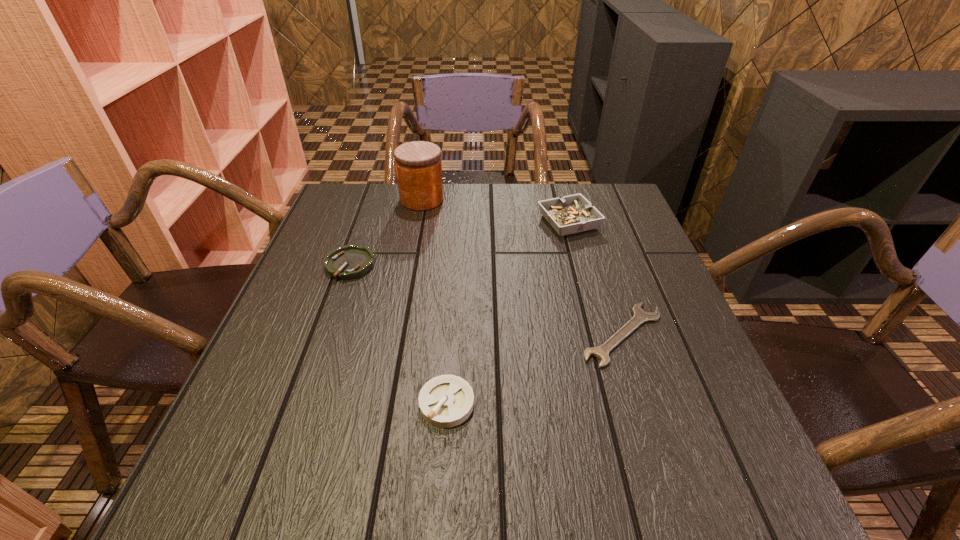
Identify the location of free space that satisfies the following two spatial constraints: 1. on the front side of the second tallest object; 2. on the right side of the wrench. The image size is (960, 540). (599, 335).

This screenshot has width=960, height=540. Identify the location of free space that satisfies the following two spatial constraints: 1. on the front side of the jar; 2. on the right side of the second ashtray from left to right. (383, 403).

This screenshot has width=960, height=540. What are the coordinates of `free space in the image that satisfies the following two spatial constraints: 1. on the front side of the jar; 2. on the left side of the shortest object` in the screenshot? It's located at click(396, 335).